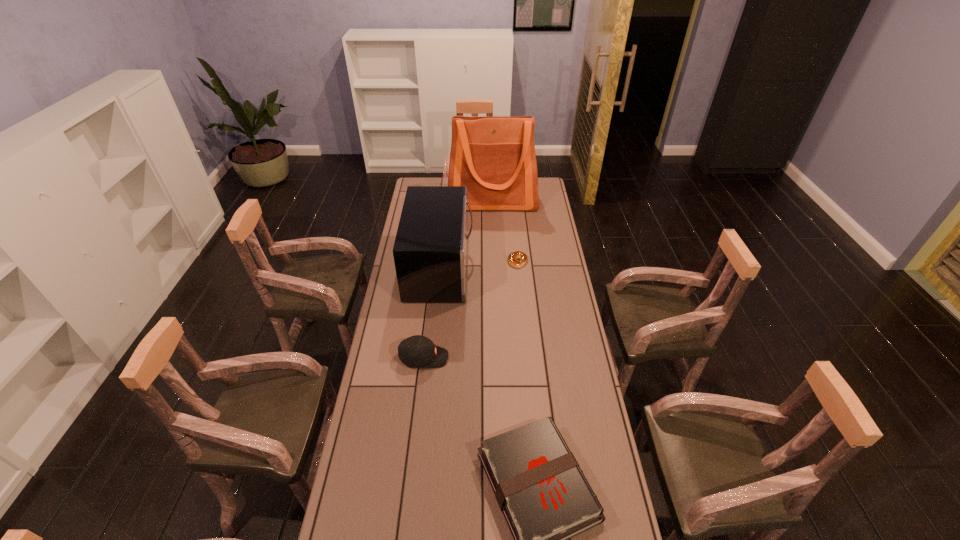
Find the location of a particular element. The width and height of the screenshot is (960, 540). microwave oven that is positioned at the left edge is located at coordinates (430, 251).

In order to click on baseball cap at the left edge in this screenshot , I will do `click(416, 351)`.

The height and width of the screenshot is (540, 960). In order to click on object that is at the right edge in this screenshot , I will do `click(494, 157)`.

Identify the location of object at the far right corner. The height and width of the screenshot is (540, 960). (494, 157).

The height and width of the screenshot is (540, 960). In order to click on free space at the left edge in this screenshot , I will do `click(396, 285)`.

At what (x,y) coordinates should I click in order to perform the action: click on vacant area at the right edge. Please return your answer as a coordinate pair (x, y). The width and height of the screenshot is (960, 540). Looking at the image, I should click on (561, 260).

Find the location of a particular element. This screenshot has height=540, width=960. vacant space that's between the shortest object and the microwave oven is located at coordinates (479, 265).

Where is `vacant region between the baseball cap and the microwave oven`? The image size is (960, 540). vacant region between the baseball cap and the microwave oven is located at coordinates (432, 313).

This screenshot has height=540, width=960. Identify the location of vacant space in between the second tallest object and the baseball cap. (432, 313).

Locate which object ranks fourth in proximity to the farthest object. Please provide its 2D coordinates. Your answer should be formatted as a tuple, i.e. [(x, y)], where the tuple contains the x and y coordinates of a point satisfying the conditions above.

[(546, 500)]